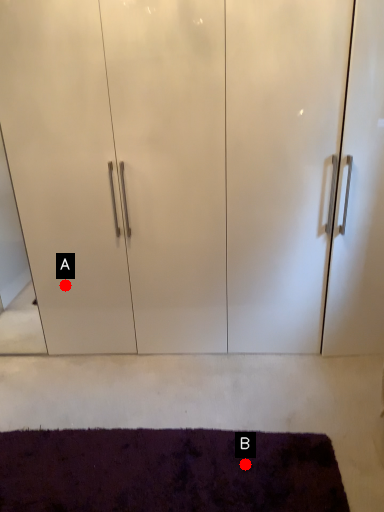
Question: Two points are circled on the image, labeled by A and B beside each circle. Which point appears closest to the camera in this image?

Choices:
 (A) A is closer
 (B) B is closer

Answer: (B)